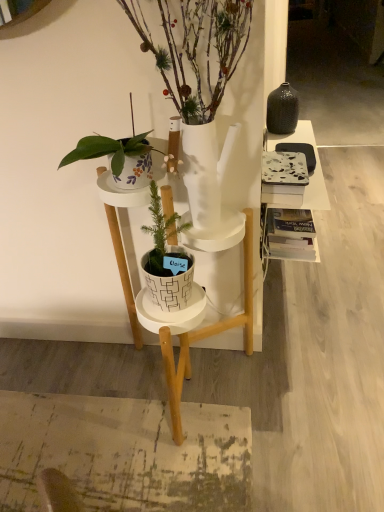
Question: Is marble-patterned book at right wider or thinner than white matte plant stand at center?

Choices:
 (A) wide
 (B) thin

Answer: (B)

Question: Is point (271, 183) positioned closer to the camera than point (115, 244)?

Choices:
 (A) closer
 (B) farther

Answer: (A)

Question: Considering the real-world distances, which object is farthest from the white glossy pot at center, arranged as the 1th houseplant when viewed from the top?

Choices:
 (A) white textured pot at center, marked as the 2th houseplant in a top-to-bottom arrangement
 (B) marble-patterned book at right
 (C) white matte plant stand at center

Answer: (C)

Question: Estimate the real-world distances between objects in this image. Which object is farther from the white matte plant stand at center?

Choices:
 (A) white glossy pot at center, arranged as the 1th houseplant when viewed from the top
 (B) white textured pot at center, positioned as the first houseplant in bottom-to-top order
 (C) marble-patterned book at right

Answer: (C)